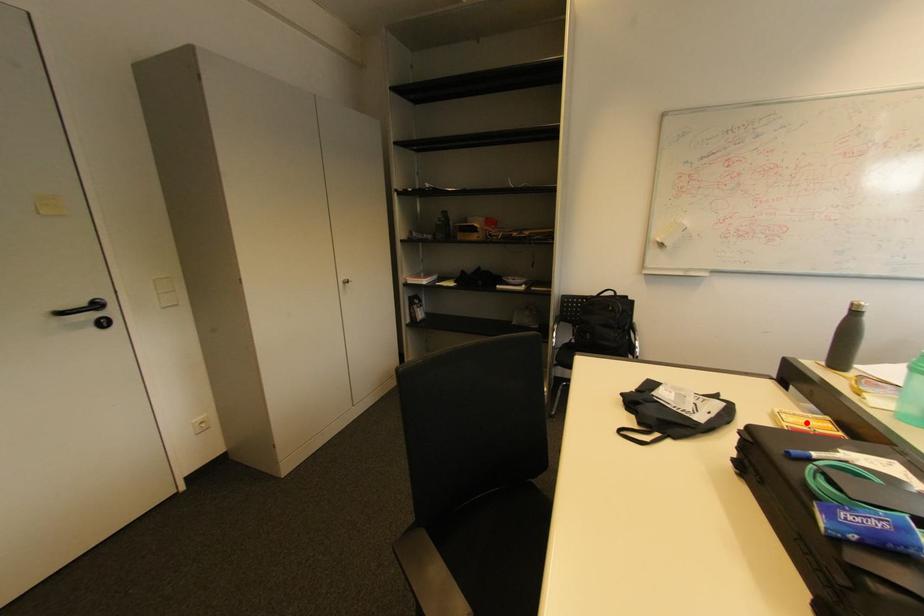
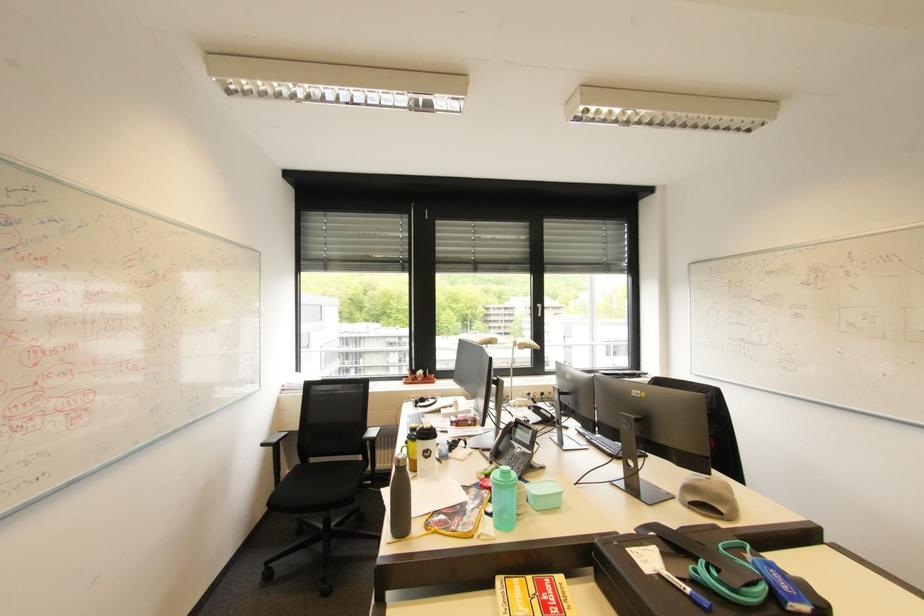
Locate, in the second image, the point that corresponds to the highlighted location in the first image.

(526, 602)